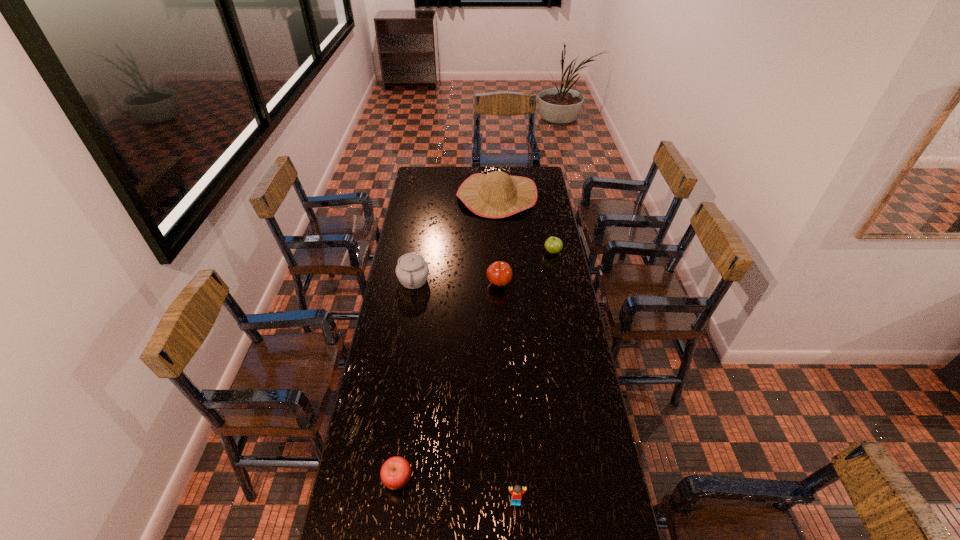
The height and width of the screenshot is (540, 960). I want to click on free spot between the fifth nearest object and the tallest apple, so click(x=526, y=268).

This screenshot has width=960, height=540. In order to click on vacant area between the farthest object and the second farthest apple in this screenshot , I will do click(498, 240).

The image size is (960, 540). In order to click on free spot between the chinaware and the second apple from left to right in this screenshot , I will do pyautogui.click(x=456, y=282).

Find the location of a particular element. This screenshot has width=960, height=540. vacant point located between the farthest apple and the farthest object is located at coordinates (525, 224).

Find the location of a particular element. Image resolution: width=960 pixels, height=540 pixels. free space between the rightmost apple and the chinaware is located at coordinates (483, 266).

Identify the location of the third closest object to the farthest apple. The width and height of the screenshot is (960, 540). (412, 271).

At what (x,y) coordinates should I click in order to perform the action: click on object that stands as the fourth closest to the nearest object. Please return your answer as a coordinate pair (x, y). Image resolution: width=960 pixels, height=540 pixels. Looking at the image, I should click on (553, 245).

Locate an element on the screen. The width and height of the screenshot is (960, 540). apple that stands as the third closest to the sunhat is located at coordinates (395, 473).

At what (x,y) coordinates should I click in order to perform the action: click on apple identified as the closest to the nearest apple. Please return your answer as a coordinate pair (x, y). The height and width of the screenshot is (540, 960). Looking at the image, I should click on (499, 273).